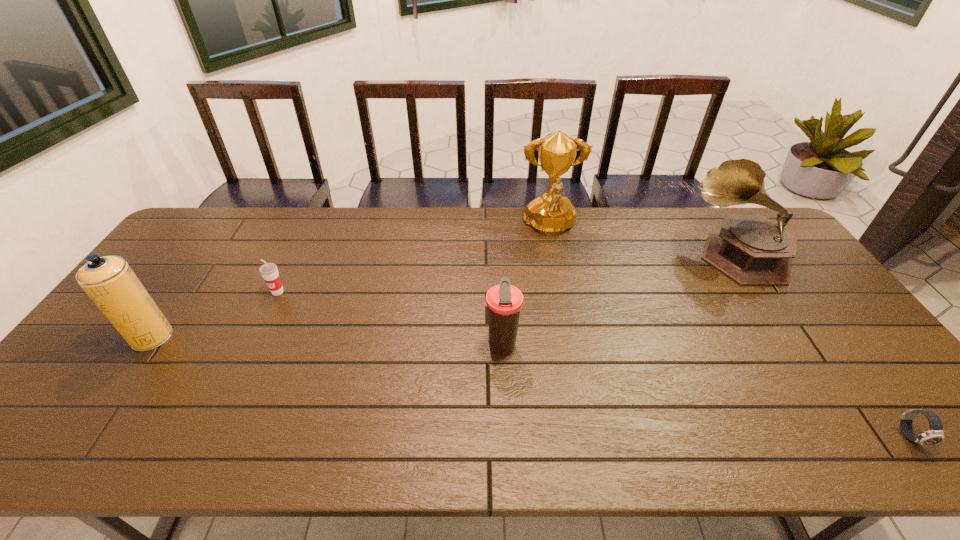
The height and width of the screenshot is (540, 960). I want to click on empty space that is in between the fourth object from left to right and the phonograph record, so click(643, 241).

Identify the location of free space between the third object from left to right and the third object from right to left. The image size is (960, 540). (525, 287).

You are a GUI agent. You are given a task and a screenshot of the screen. Output one action in this format:
    pyautogui.click(x=<x>, y=<y>)
    Task: Click on the blank region between the aerosol can and the fourth tallest object
    The width and height of the screenshot is (960, 540).
    Given the screenshot: What is the action you would take?
    pyautogui.click(x=326, y=342)

Find the location of a particular element. The image size is (960, 540). vacant space that is in between the phonograph record and the leftmost object is located at coordinates (444, 295).

Image resolution: width=960 pixels, height=540 pixels. In order to click on empty space that is in between the thermos bottle and the third object from right to left in this screenshot , I will do `click(525, 287)`.

The height and width of the screenshot is (540, 960). In order to click on free space between the shortest object and the third object from right to left in this screenshot , I will do `click(730, 332)`.

Where is `free space between the phonograph record and the thermos bottle`? The image size is (960, 540). free space between the phonograph record and the thermos bottle is located at coordinates (619, 300).

Locate an element on the screen. object that ranks as the third closest to the third object from left to right is located at coordinates (750, 249).

Where is `object that stands as the second closest to the award`? object that stands as the second closest to the award is located at coordinates (504, 301).

The width and height of the screenshot is (960, 540). In order to click on vacant space that satisfies the following two spatial constraints: 1. on the horn direction of the phonograph record; 2. on the side of the cup with the logo in this screenshot , I will do `click(762, 292)`.